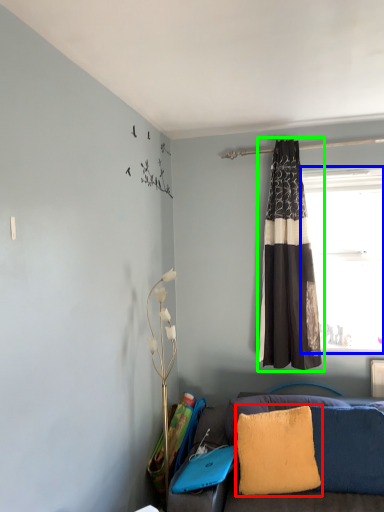
Question: Estimate the real-world distances between objects in this image. Which object is closer to pillow (highlighted by a red box), window (highlighted by a blue box) or curtain (highlighted by a green box)?

Choices:
 (A) window
 (B) curtain

Answer: (B)